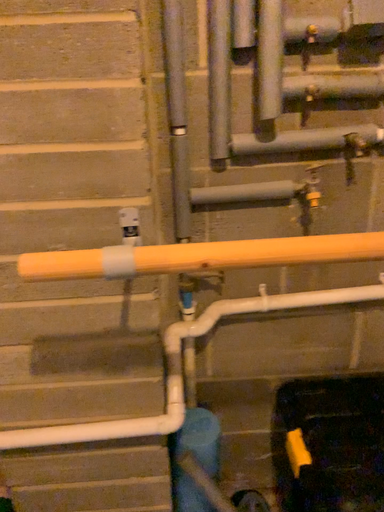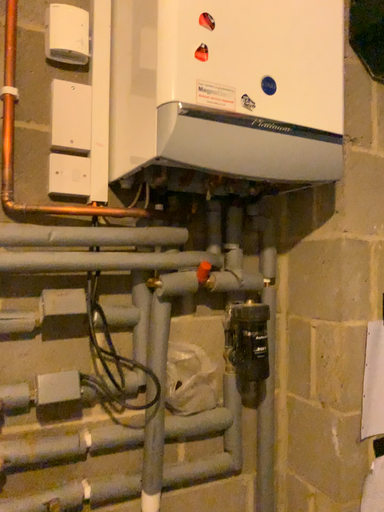
Question: How did the camera likely rotate when shooting the video?

Choices:
 (A) rotated right
 (B) rotated left

Answer: (A)